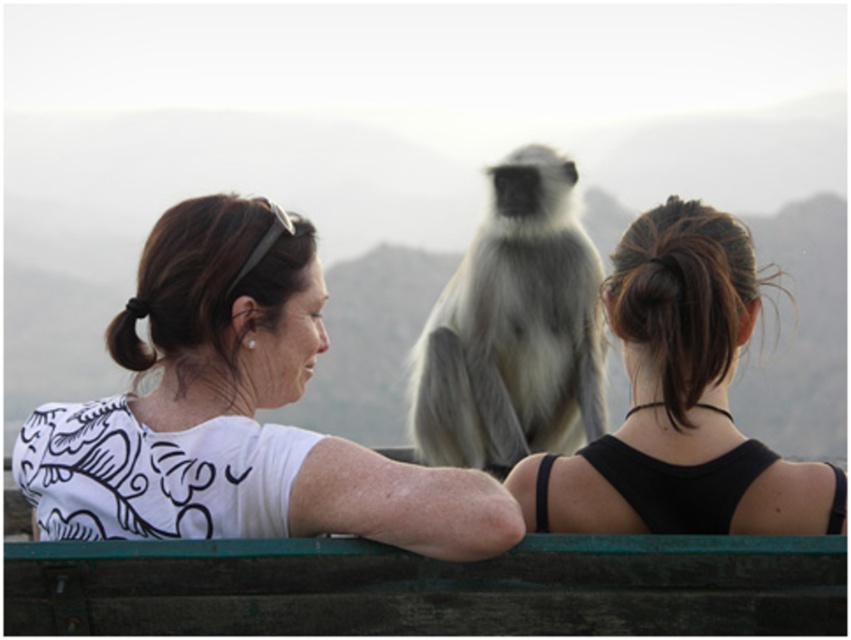
Question: Does white printed shirt at left come behind green wooden rail at lower center?

Choices:
 (A) no
 (B) yes

Answer: (A)

Question: Which of the following is the closest to the observer?

Choices:
 (A) (254, 589)
 (B) (197, 477)
 (C) (687, 401)

Answer: (A)

Question: Which object is closer to the camera taking this photo?

Choices:
 (A) black matte ponytail at center
 (B) green wooden rail at lower center
 (C) gray furry monkey at center
 (D) white printed shirt at left

Answer: (D)

Question: Does white printed shirt at left appear over green wooden rail at lower center?

Choices:
 (A) yes
 (B) no

Answer: (A)

Question: Is white printed shirt at left positioned before green wooden rail at lower center?

Choices:
 (A) no
 (B) yes

Answer: (B)

Question: Which object appears farthest from the camera in this image?

Choices:
 (A) gray furry monkey at center
 (B) white printed shirt at left

Answer: (A)